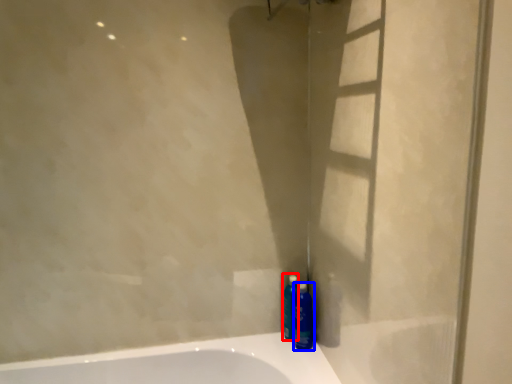
Question: Which object is further to the camera taking this photo, cleaning product (highlighted by a red box) or mouthwash (highlighted by a blue box)?

Choices:
 (A) cleaning product
 (B) mouthwash

Answer: (A)